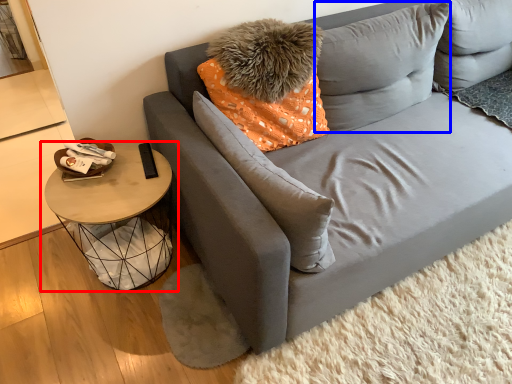
Question: Which of the following is the closest to the observer, table (highlighted by a red box) or pillow (highlighted by a blue box)?

Choices:
 (A) table
 (B) pillow

Answer: (A)